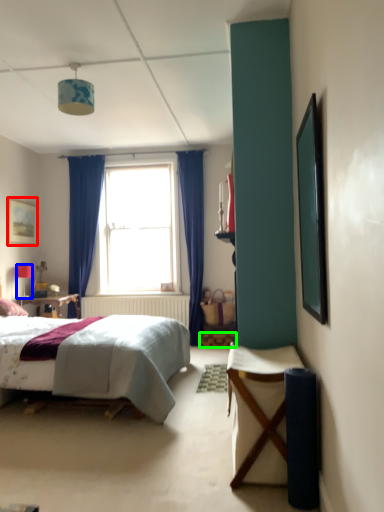
Question: Considering the real-world distances, which object is closest to picture frame (highlighted by a red box)? lamp (highlighted by a blue box) or stool (highlighted by a green box).

Choices:
 (A) lamp
 (B) stool

Answer: (A)